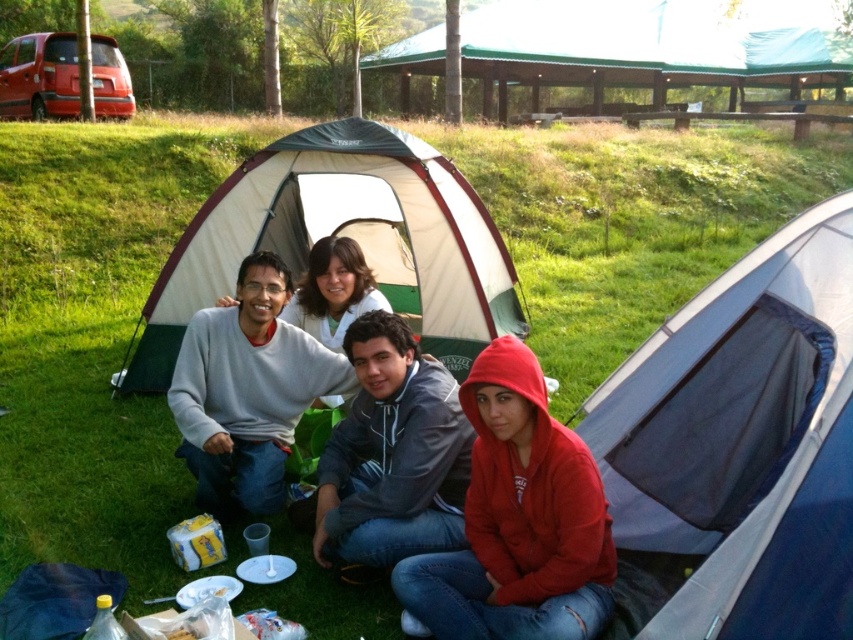
Who is higher up, blue fabric tent at center or red fleece hoodie at lower right?

blue fabric tent at center

This screenshot has width=853, height=640. In order to click on blue fabric tent at center in this screenshot , I will do `click(743, 442)`.

At what (x,y) coordinates should I click in order to perform the action: click on blue fabric tent at center. Please return your answer as a coordinate pair (x, y). This screenshot has width=853, height=640. Looking at the image, I should click on (743, 442).

Between white canvas tent at center and gray matte sweater at center, which one is positioned higher?

white canvas tent at center is higher up.

Is white canvas tent at center positioned at the back of gray matte sweater at center?

Yes.

Describe the element at coordinates (343, 236) in the screenshot. I see `white canvas tent at center` at that location.

The height and width of the screenshot is (640, 853). In order to click on white canvas tent at center in this screenshot , I will do click(343, 236).

Is point (421, 516) positioned in front of point (289, 332)?

Yes, it is in front of point (289, 332).

Which is in front, point (453, 426) or point (170, 410)?

Point (453, 426) is more forward.

Where is `gray fleece hoodie at center`? This screenshot has width=853, height=640. gray fleece hoodie at center is located at coordinates point(392,452).